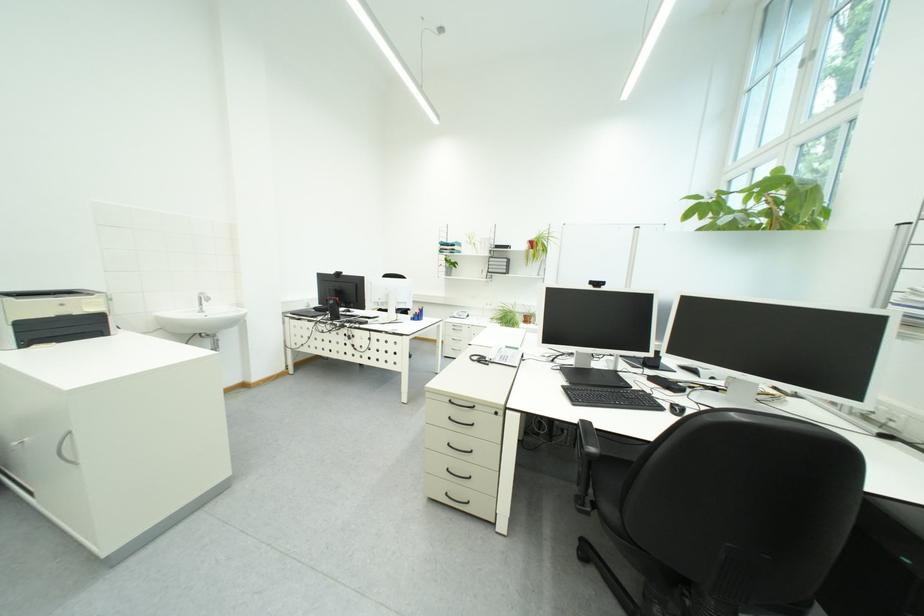
The image size is (924, 616). I want to click on white water bottle, so click(x=391, y=305).